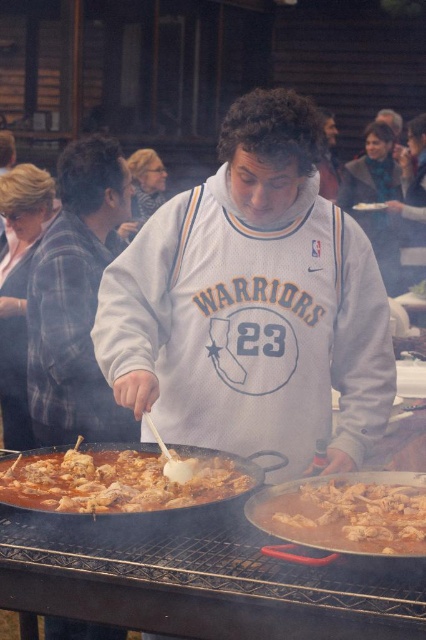
Can you confirm if white jersey at center is positioned to the left of plaid fabric shirt at left?

Incorrect, white jersey at center is not on the left side of plaid fabric shirt at left.

Is point (221, 259) positioned behind point (85, 193)?

No.

At what (x,y) coordinates should I click in order to perform the action: click on white jersey at center. Please return your answer as a coordinate pair (x, y). This screenshot has height=640, width=426. Looking at the image, I should click on (253, 304).

In the scene shown: Can you confirm if white jersey at center is positioned to the left of brown matte chicken at center?

Yes, white jersey at center is to the left of brown matte chicken at center.

Is point (203, 195) closer to camera compared to point (336, 548)?

That is False.

Where is `white jersey at center`? white jersey at center is located at coordinates (253, 304).

The height and width of the screenshot is (640, 426). What do you see at coordinates (353, 515) in the screenshot? I see `brown matte chicken at center` at bounding box center [353, 515].

Is point (400, 499) farther from camera compared to point (383, 209)?

That is False.

Which is in front, point (298, 497) or point (365, 208)?

Point (298, 497) is in front.

The image size is (426, 640). In order to click on brown matte chicken at center in this screenshot , I will do `click(353, 515)`.